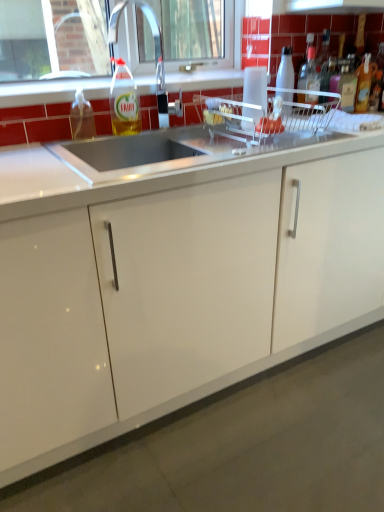
Question: Considering the relative sizes of translucent plastic bottle at right, the sixth bottle from the left, and white glossy bottle at upper right, the fourth bottle when ordered from right to left, in the image provided, is translucent plastic bottle at right, the sixth bottle from the left, wider than white glossy bottle at upper right, the fourth bottle when ordered from right to left,?

Choices:
 (A) yes
 (B) no

Answer: (B)

Question: Is translucent plastic bottle at right, the sixth bottle from the left, thinner than white glossy bottle at upper right, placed as the third bottle when sorted from left to right?

Choices:
 (A) yes
 (B) no

Answer: (A)

Question: From the image's perspective, is translucent plastic bottle at right, the sixth bottle from the left, located beneath white glossy bottle at upper right, placed as the third bottle when sorted from left to right?

Choices:
 (A) no
 (B) yes

Answer: (A)

Question: Does translucent plastic bottle at right, the sixth bottle from the left, have a smaller size compared to white glossy bottle at upper right, placed as the third bottle when sorted from left to right?

Choices:
 (A) yes
 (B) no

Answer: (A)

Question: From the image's perspective, would you say translucent plastic bottle at right, the sixth bottle from the left, is positioned over white glossy bottle at upper right, placed as the third bottle when sorted from left to right?

Choices:
 (A) yes
 (B) no

Answer: (A)

Question: Is satin steel sink at upper center in front of or behind white glossy bottle at upper right, placed as the third bottle when sorted from left to right, in the image?

Choices:
 (A) front
 (B) behind

Answer: (A)

Question: Is satin steel sink at upper center taller or shorter than white glossy bottle at upper right, the fourth bottle when ordered from right to left?

Choices:
 (A) tall
 (B) short

Answer: (A)

Question: Is satin steel sink at upper center wider or thinner than white glossy bottle at upper right, the fourth bottle when ordered from right to left?

Choices:
 (A) thin
 (B) wide

Answer: (A)

Question: Is satin steel sink at upper center spatially inside white glossy bottle at upper right, placed as the third bottle when sorted from left to right, or outside of it?

Choices:
 (A) outside
 (B) inside

Answer: (A)

Question: Considering their positions, is white glossy bottle at upper right, placed as the third bottle when sorted from left to right, located in front of or behind clear glass window at upper center?

Choices:
 (A) behind
 (B) front

Answer: (A)

Question: Is white glossy bottle at upper right, placed as the third bottle when sorted from left to right, taller or shorter than clear glass window at upper center?

Choices:
 (A) tall
 (B) short

Answer: (B)

Question: From the image's perspective, is white glossy bottle at upper right, placed as the third bottle when sorted from left to right, above or below clear glass window at upper center?

Choices:
 (A) below
 (B) above

Answer: (A)

Question: From a real-world perspective, is white glossy bottle at upper right, placed as the third bottle when sorted from left to right, above or below clear glass window at upper center?

Choices:
 (A) above
 (B) below

Answer: (B)

Question: Is clear plastic faucet at upper center inside or outside of satin steel sink at upper center?

Choices:
 (A) outside
 (B) inside

Answer: (A)

Question: Visually, is clear plastic faucet at upper center positioned to the left or to the right of satin steel sink at upper center?

Choices:
 (A) left
 (B) right

Answer: (A)